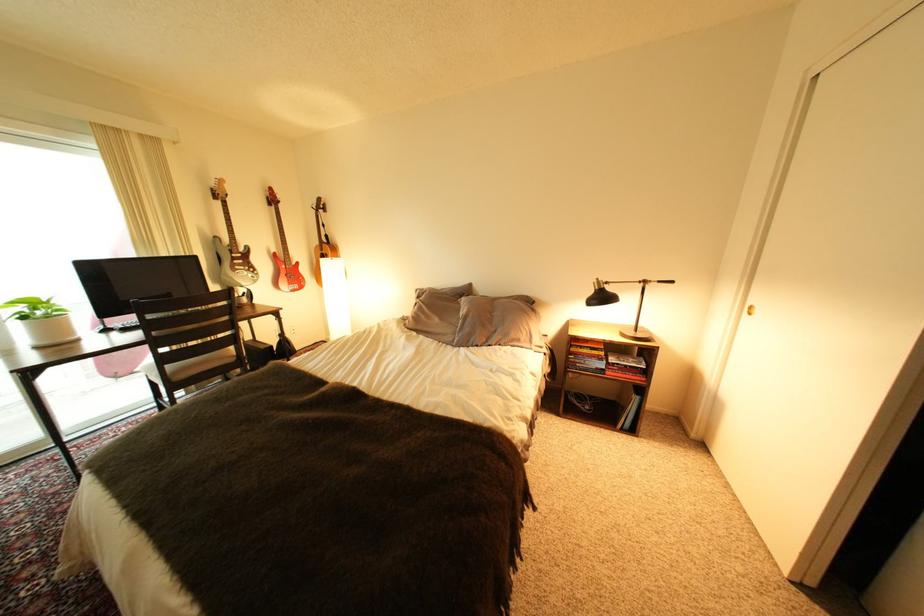
The height and width of the screenshot is (616, 924). What do you see at coordinates (749, 310) in the screenshot? I see `the closet door pull` at bounding box center [749, 310].